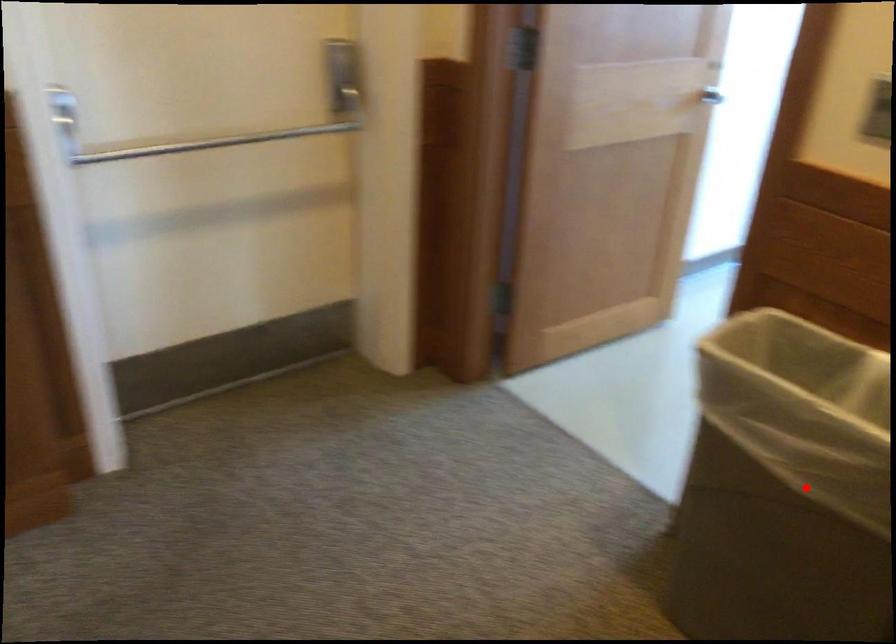
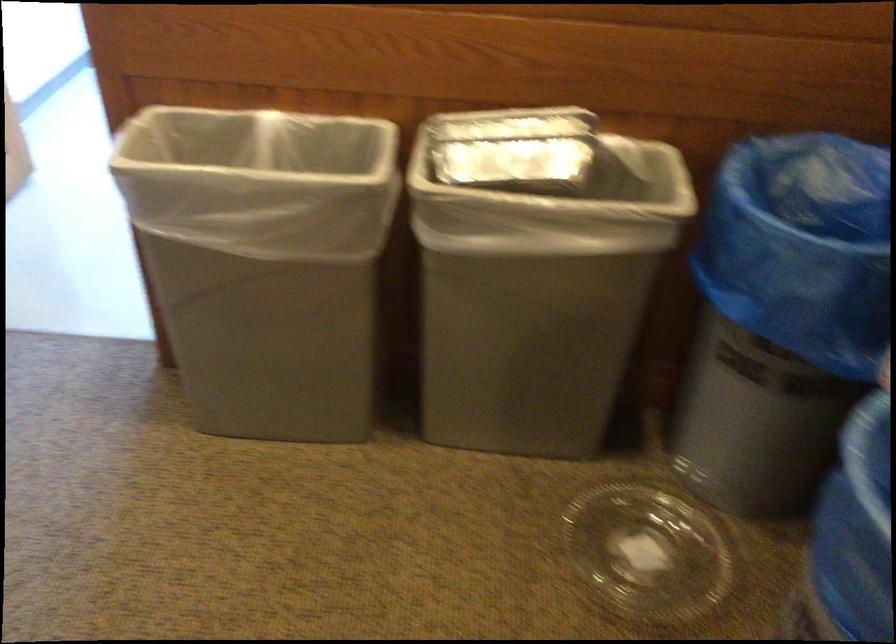
Where in the second image is the point corresponding to the highlighted location from the first image?

(263, 261)